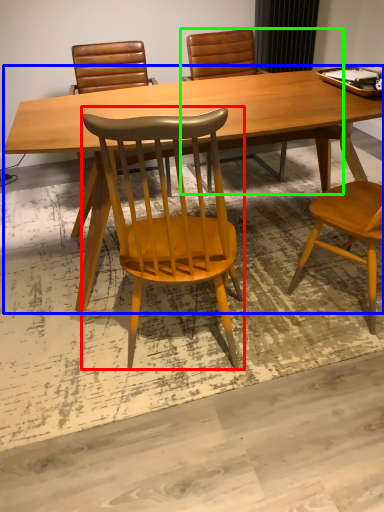
Question: Based on their relative distances, which object is nearer to chair (highlighted by a red box)? Choose from desk (highlighted by a blue box) and chair (highlighted by a green box).

Choices:
 (A) desk
 (B) chair

Answer: (A)